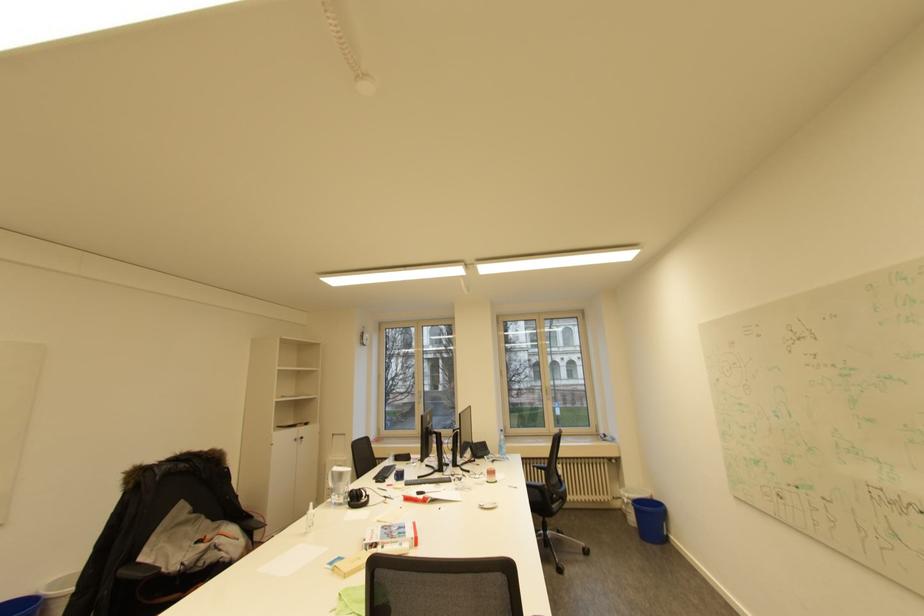
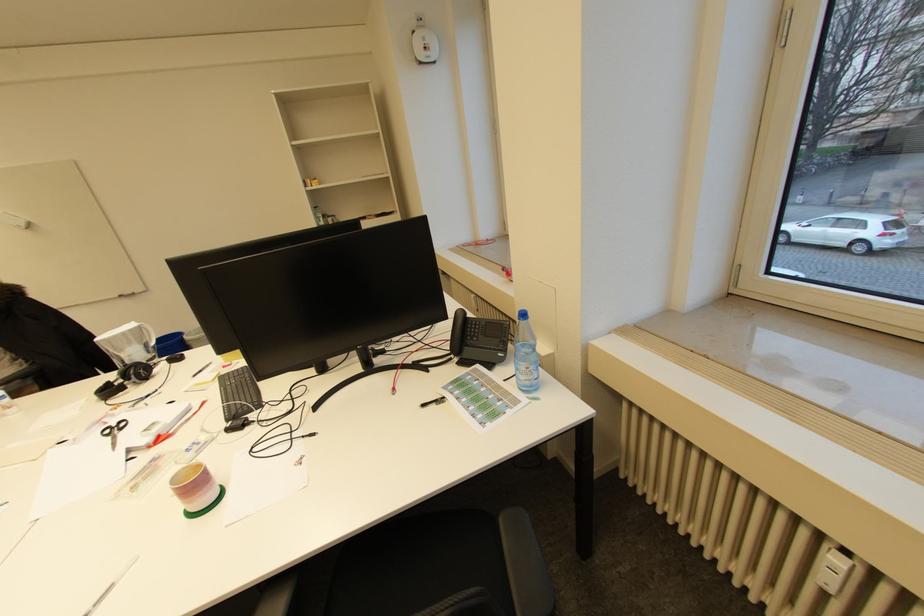
Find the pixel in the second image that matches (x=565, y=472) in the first image.

(833, 580)